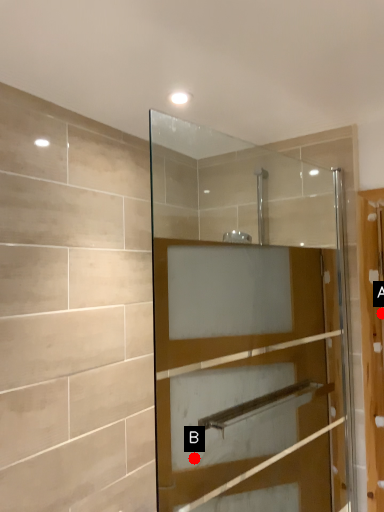
Question: Two points are circled on the image, labeled by A and B beside each circle. Which point appears closest to the camera in this image?

Choices:
 (A) A is closer
 (B) B is closer

Answer: (B)